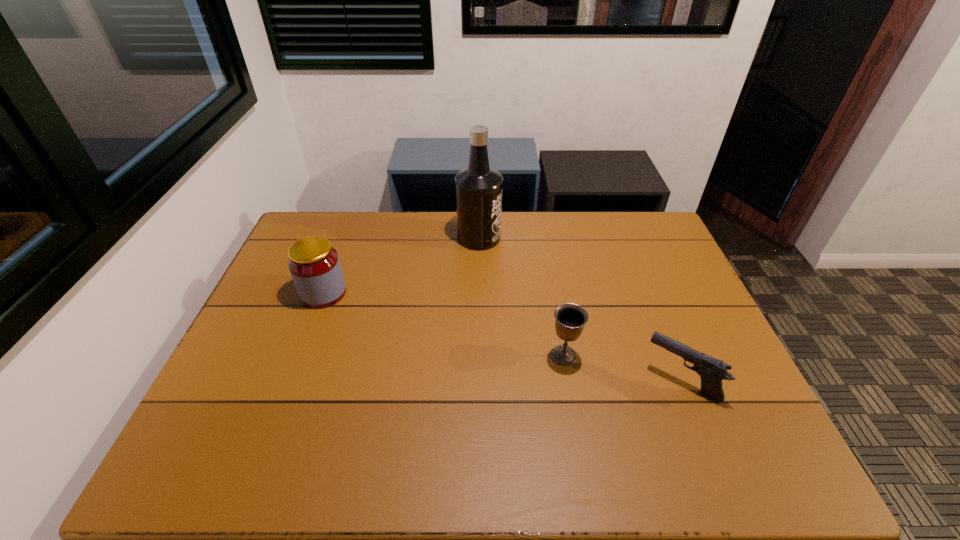
Locate an element on the screen. the tallest object is located at coordinates (478, 188).

Locate an element on the screen. The width and height of the screenshot is (960, 540). liquor is located at coordinates (478, 188).

The height and width of the screenshot is (540, 960). I want to click on the leftmost object, so click(314, 264).

Locate an element on the screen. the third nearest object is located at coordinates 314,264.

Where is `the second object from right to left`? This screenshot has width=960, height=540. the second object from right to left is located at coordinates (570, 318).

Find the location of `the rightmost object`. the rightmost object is located at coordinates (712, 371).

The width and height of the screenshot is (960, 540). I want to click on the shortest object, so click(712, 371).

Where is `vacant space located on the front label of the tallest object`? vacant space located on the front label of the tallest object is located at coordinates (518, 238).

Identify the location of free region located 0.060m on the right of the jar. (366, 293).

You are a GUI agent. You are given a task and a screenshot of the screen. Output one action in this format:
    pyautogui.click(x=<x>, y=<y>)
    Task: Click on the free space located on the left of the second object from right to left
    The width and height of the screenshot is (960, 540).
    Given the screenshot: What is the action you would take?
    coord(443,355)